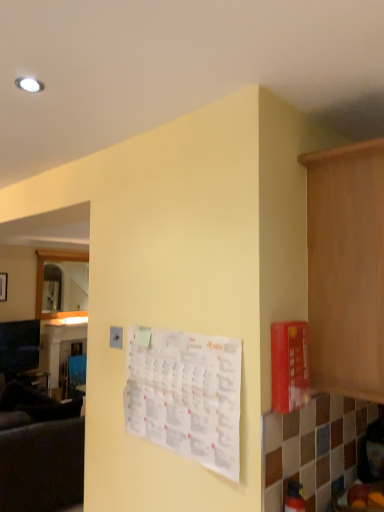
Question: Can you confirm if wooden cabinet at right is smaller than white paper calendar at center?

Choices:
 (A) no
 (B) yes

Answer: (A)

Question: Is wooden cabinet at right thinner than white paper calendar at center?

Choices:
 (A) yes
 (B) no

Answer: (B)

Question: Considering the relative sizes of wooden cabinet at right and white paper calendar at center in the image provided, is wooden cabinet at right bigger than white paper calendar at center?

Choices:
 (A) yes
 (B) no

Answer: (A)

Question: Can you confirm if wooden cabinet at right is wider than white paper calendar at center?

Choices:
 (A) yes
 (B) no

Answer: (A)

Question: Is wooden cabinet at right positioned behind white paper calendar at center?

Choices:
 (A) no
 (B) yes

Answer: (A)

Question: Is wooden cabinet at right wider or thinner than dark gray fabric couch at left?

Choices:
 (A) thin
 (B) wide

Answer: (A)

Question: From the image's perspective, is wooden cabinet at right located above or below dark gray fabric couch at left?

Choices:
 (A) above
 (B) below

Answer: (A)

Question: Considering the positions of point pyautogui.click(x=314, y=380) and point pyautogui.click(x=23, y=502), is point pyautogui.click(x=314, y=380) closer or farther from the camera than point pyautogui.click(x=23, y=502)?

Choices:
 (A) farther
 (B) closer

Answer: (B)

Question: Visually, is wooden cabinet at right positioned to the left or to the right of dark gray fabric couch at left?

Choices:
 (A) left
 (B) right

Answer: (B)

Question: From a real-world perspective, is dark gray fabric couch at left physically located above or below white paper calendar at center?

Choices:
 (A) below
 (B) above

Answer: (A)

Question: Do you think dark gray fabric couch at left is within white paper calendar at center, or outside of it?

Choices:
 (A) outside
 (B) inside

Answer: (A)

Question: From the image's perspective, is dark gray fabric couch at left above or below white paper calendar at center?

Choices:
 (A) above
 (B) below

Answer: (B)

Question: Looking at the image, does dark gray fabric couch at left seem bigger or smaller compared to white paper calendar at center?

Choices:
 (A) small
 (B) big

Answer: (B)

Question: Considering their positions, is wooden cabinet at right located in front of or behind white paper calendar at center?

Choices:
 (A) behind
 (B) front

Answer: (B)

Question: Visually, is wooden cabinet at right positioned to the left or to the right of white paper calendar at center?

Choices:
 (A) right
 (B) left

Answer: (A)